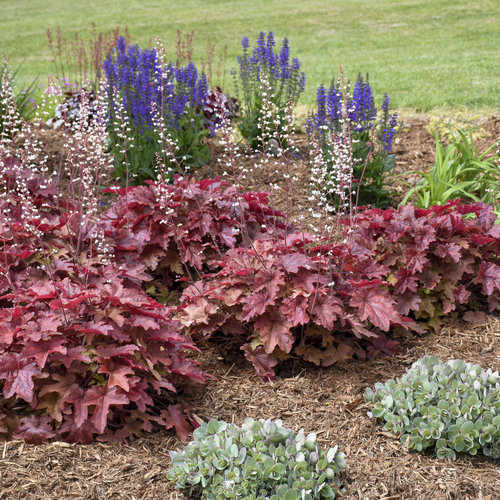
This screenshot has height=500, width=500. What are the coordinates of `two small short green plants` in the screenshot? It's located at (261, 463), (448, 402).